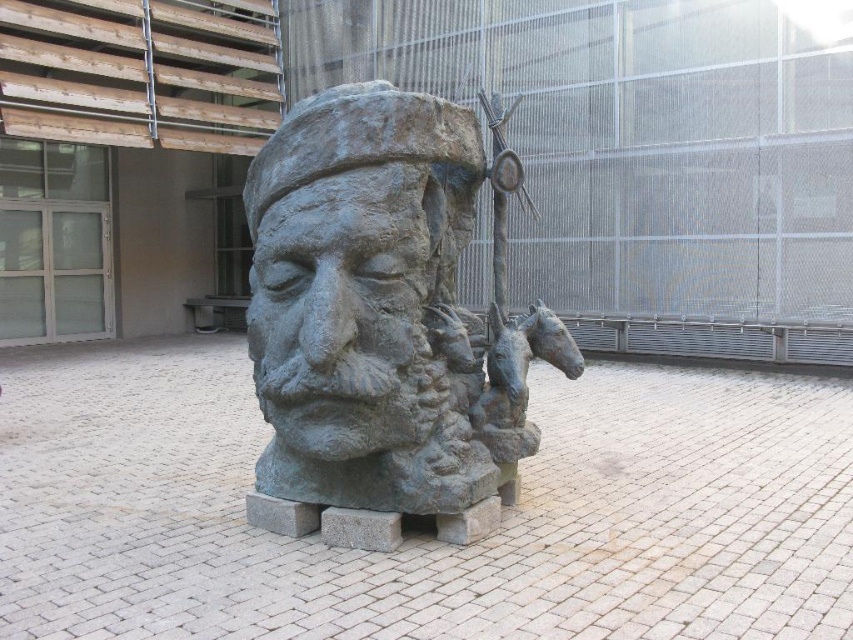
Who is positioned more to the left, bronze statue at center or bronze sculpture at center?

bronze sculpture at center

Can you confirm if bronze statue at center is positioned to the right of bronze sculpture at center?

Yes, bronze statue at center is to the right of bronze sculpture at center.

Is point (339, 458) behind point (276, 326)?

No, it is in front of (276, 326).

Identify the location of bronze statue at center. The height and width of the screenshot is (640, 853). (384, 323).